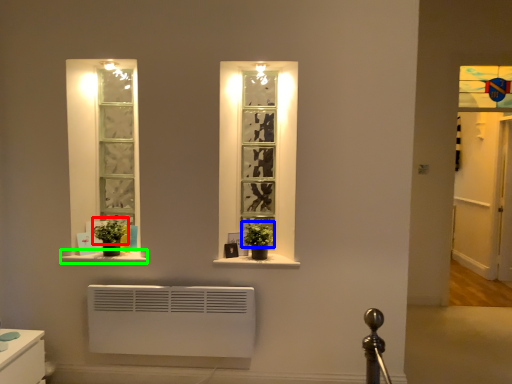
Question: Based on their relative distances, which object is nearer to plant (highlighted by a red box)? Choose from plant (highlighted by a blue box) and window sill (highlighted by a green box).

Choices:
 (A) plant
 (B) window sill

Answer: (B)